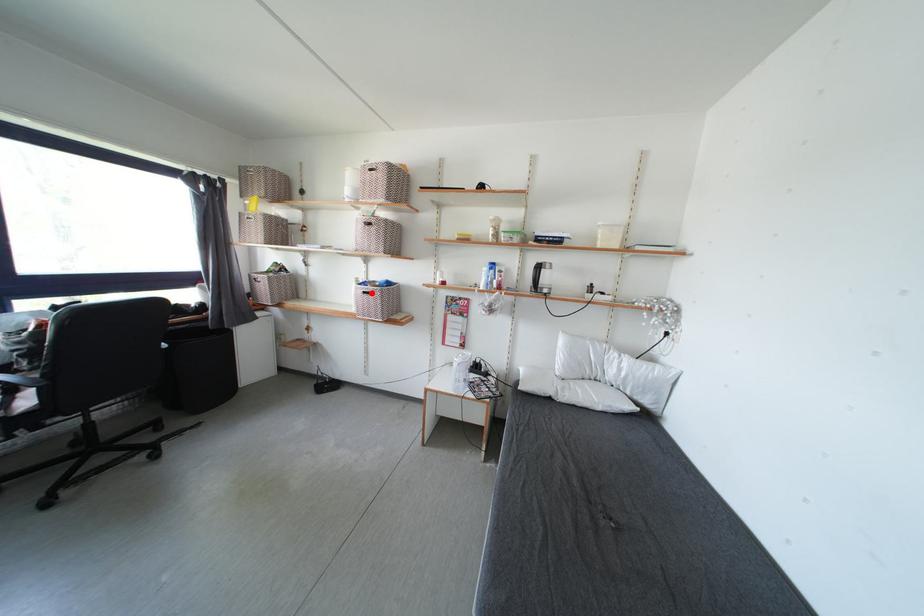
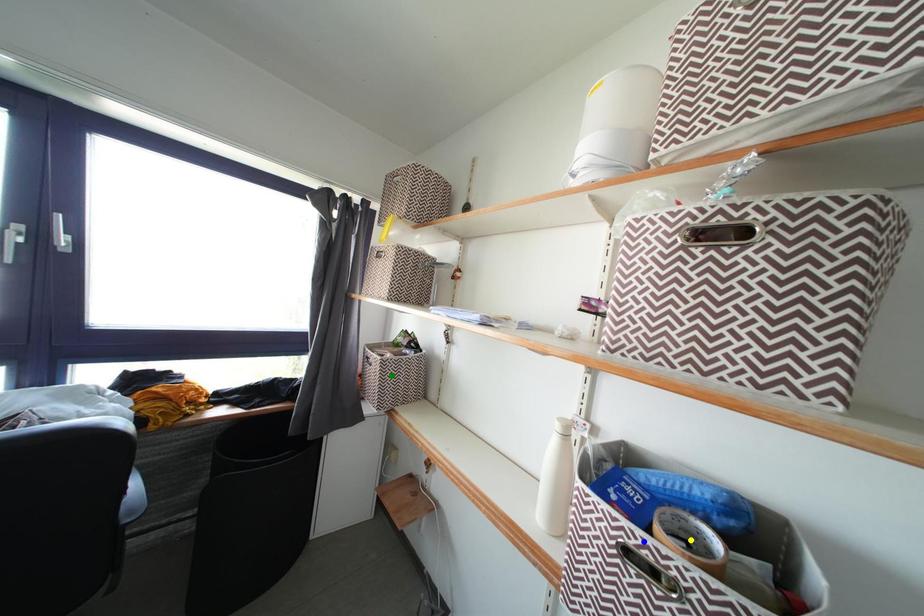
Question: I am providing you with two images of the same scene from different viewpoints. A red point is marked on the first image. You are given multiple points on the second image. Which spot in image 2 lines up with the point in image 1?

Choices:
 (A) yellow point
 (B) blue point
 (C) green point

Answer: (B)